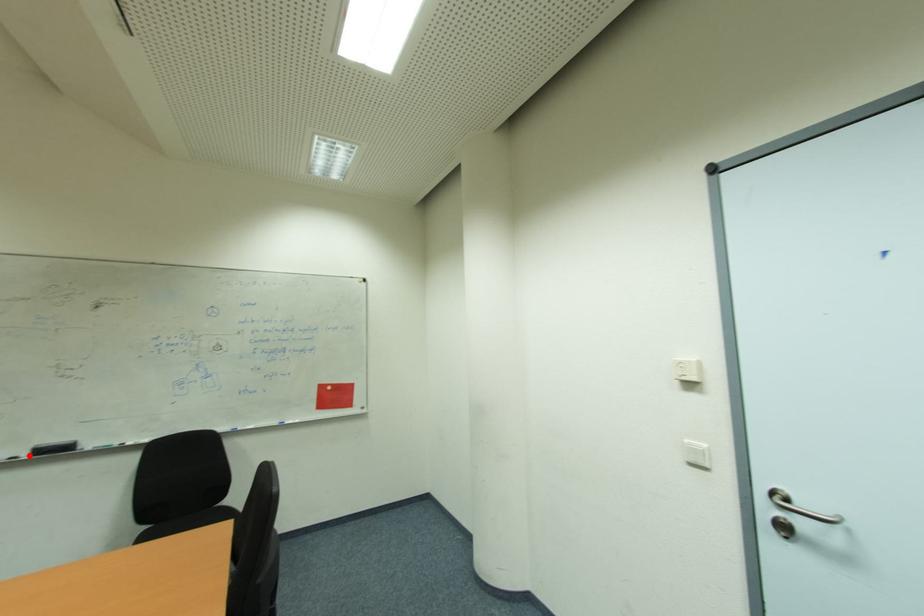
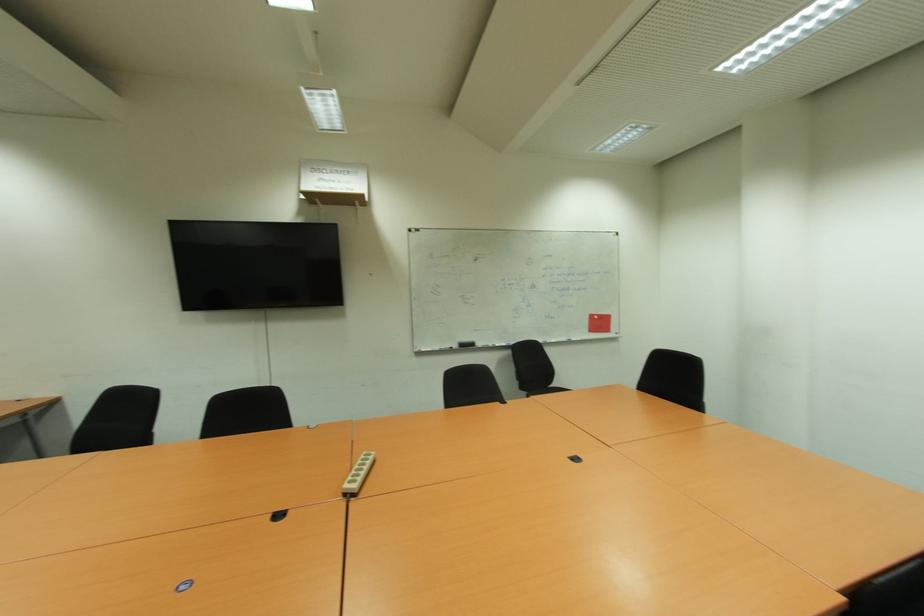
The point at the highlighted location is marked in the first image. Where is the corresponding point in the second image?

(457, 347)